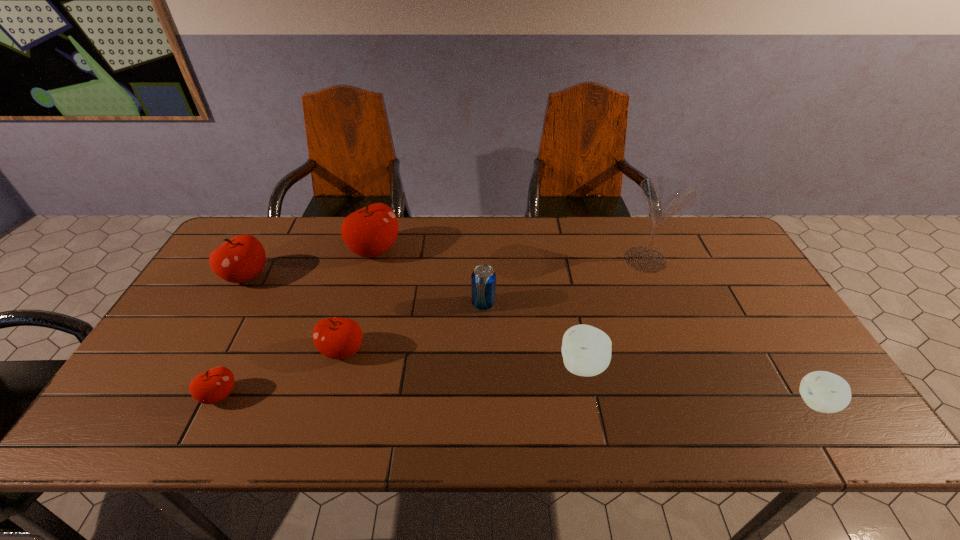
At what (x,y) coordinates should I click in order to perform the action: click on the second nearest red apple. Please return your answer as a coordinate pair (x, y). The image size is (960, 540). Looking at the image, I should click on (338, 338).

Where is `the rightmost object`? the rightmost object is located at coordinates (822, 391).

Find the location of a particular element. The image size is (960, 540). the nearer white apple is located at coordinates (822, 391).

Locate an element on the screen. This screenshot has height=540, width=960. the smallest red apple is located at coordinates (212, 386).

I want to click on free space located on the front of the tallest object, so click(700, 390).

Find the location of a particular element. The image size is (960, 540). vacant space located on the right of the biggest red apple is located at coordinates (475, 250).

Find the location of `vacant position located 0.330m on the right of the second tallest apple`. vacant position located 0.330m on the right of the second tallest apple is located at coordinates (379, 276).

Locate an element on the screen. Image resolution: width=960 pixels, height=540 pixels. blank space located on the left of the blue beer can is located at coordinates (334, 304).

What are the coordinates of `free space located on the left of the left white apple` in the screenshot? It's located at (x=488, y=366).

The height and width of the screenshot is (540, 960). I want to click on vacant region located 0.350m on the left of the second nearest red apple, so click(x=182, y=351).